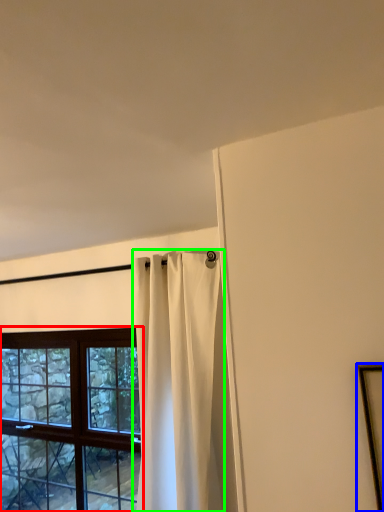
Question: Considering the real-world distances, which object is farthest from window (highlighted by a red box)? picture frame (highlighted by a blue box) or curtain (highlighted by a green box)?

Choices:
 (A) picture frame
 (B) curtain

Answer: (A)